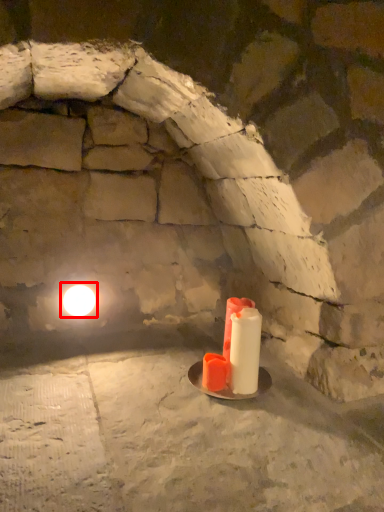
Question: From the image's perspective, where is light (annotated by the red box) located in relation to candle in the image?

Choices:
 (A) above
 (B) below

Answer: (A)